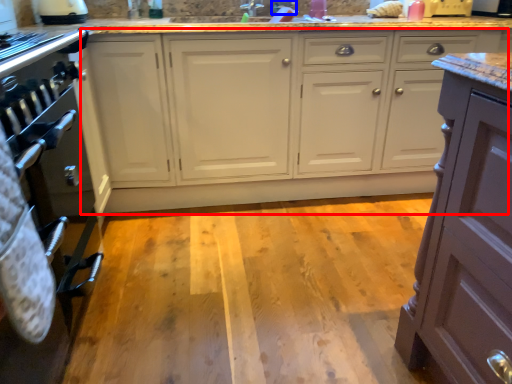
Question: Which object is further to the camera taking this photo, cabinetry (highlighted by a red box) or faucet (highlighted by a blue box)?

Choices:
 (A) cabinetry
 (B) faucet

Answer: (B)